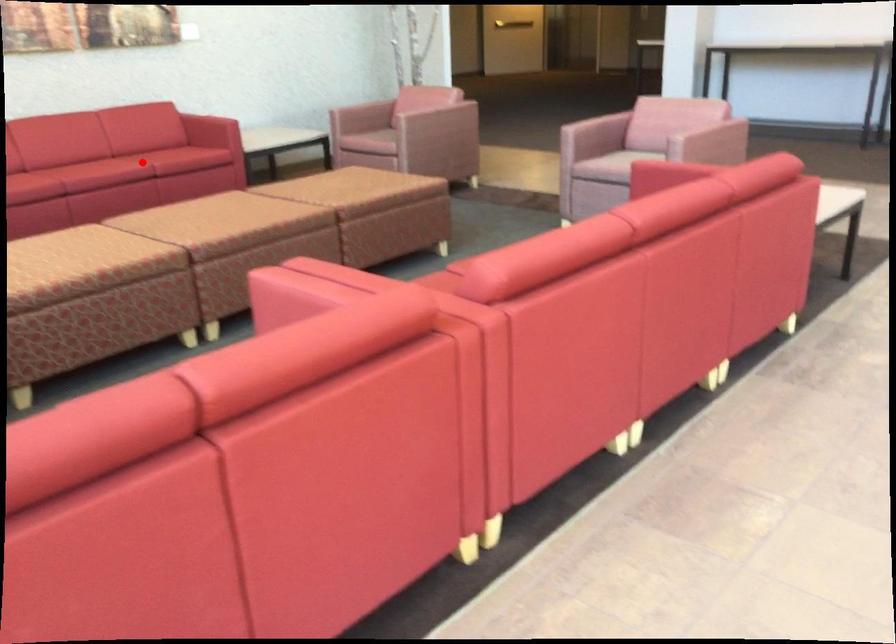
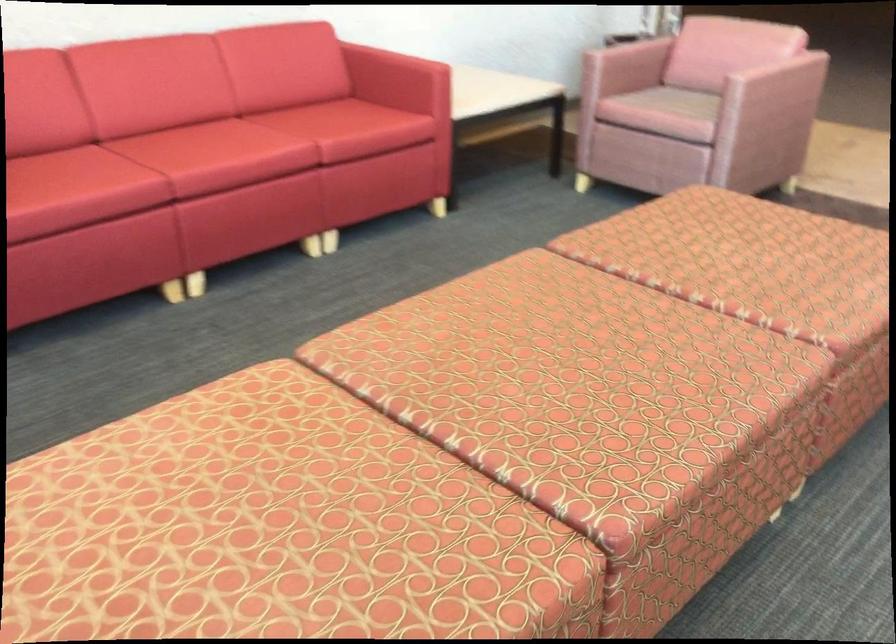
Question: A red point is marked in image1. In image2, is the corresponding 3D point closer to the camera or farther? Reply with the corresponding letter.

Choices:
 (A) The corresponding 3D point is closer.
 (B) The corresponding 3D point is farther.

Answer: (A)